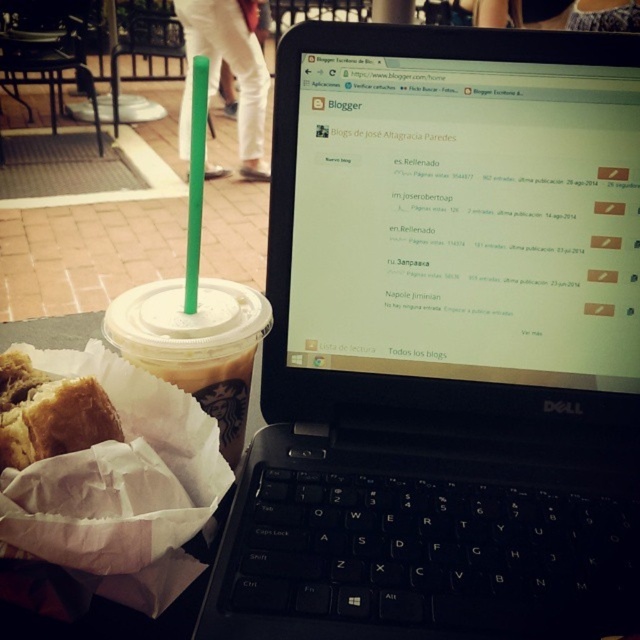
Is point (509, 278) closer to viewer compared to point (141, 316)?

No, it is behind (141, 316).

In the scene shown: Who is higher up, black plastic laptop at center or translucent plastic cup at left?

black plastic laptop at center is higher up.

Who is more forward, [486,157] or [144,292]?

Point [144,292] is more forward.

At what (x,y) coordinates should I click in order to perform the action: click on black plastic laptop at center. Please return your answer as a coordinate pair (x, y). This screenshot has width=640, height=640. Looking at the image, I should click on (444, 342).

Is black plastic laptop at center positioned behind golden brown bread at lower left?

Yes, it is.

Between black plastic laptop at center and golden brown bread at lower left, which one has more height?

black plastic laptop at center is taller.

Looking at this image, measure the distance between black plastic laptop at center and camera.

11.98 inches

The height and width of the screenshot is (640, 640). Find the location of `black plastic laptop at center`. black plastic laptop at center is located at coordinates (444, 342).

Can you confirm if translucent plastic cup at left is positioned below golden brown bread at lower left?

Actually, translucent plastic cup at left is above golden brown bread at lower left.

Is point (211, 372) positioned behind point (26, 380)?

Yes, it is behind point (26, 380).

Is point (218, 326) farther from camera compared to point (44, 422)?

Yes.

You are a GUI agent. You are given a task and a screenshot of the screen. Output one action in this format:
    pyautogui.click(x=<x>, y=<y>)
    Task: Click on the translucent plastic cup at left
    This screenshot has width=640, height=640.
    Given the screenshot: What is the action you would take?
    pyautogui.click(x=195, y=344)